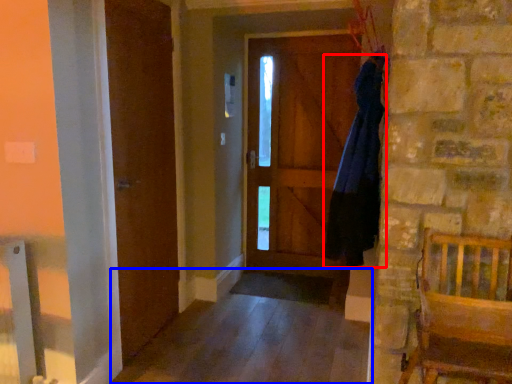
Question: Which of the following is the closest to the observer, dress (highlighted by a red box) or alley (highlighted by a blue box)?

Choices:
 (A) dress
 (B) alley

Answer: (B)